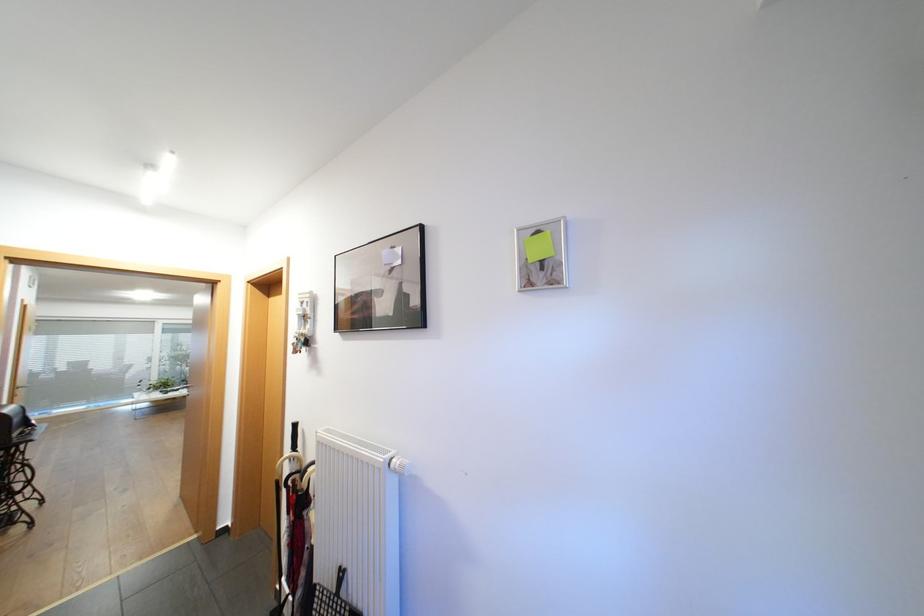
Locate an element on the screen. white radiator knob is located at coordinates (397, 464).